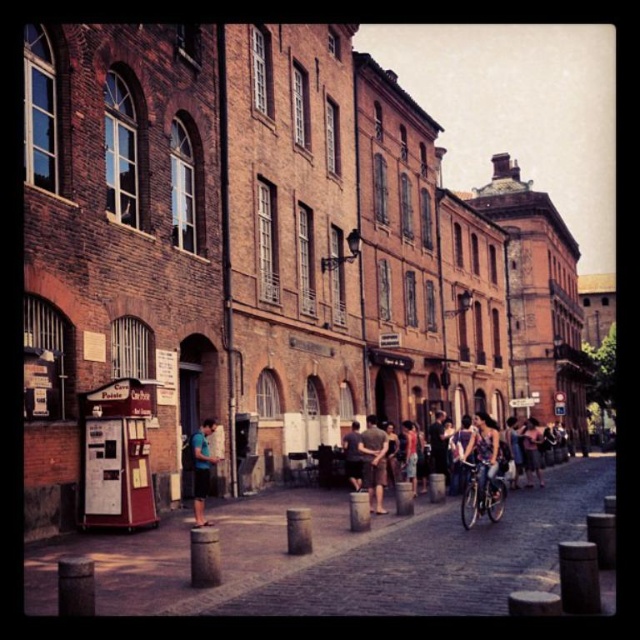
Question: Is blue fabric shirt at center wider than dark gray fabric pants at center?

Choices:
 (A) yes
 (B) no

Answer: (A)

Question: Which point is farther from the camera taking this photo?

Choices:
 (A) (208, 433)
 (B) (353, 477)
 (C) (488, 506)

Answer: (B)

Question: Which point is closer to the camera taking this photo?

Choices:
 (A) (476, 493)
 (B) (499, 515)
 (C) (200, 429)

Answer: (A)

Question: In this image, where is shiny silver bicycle at center-right located relative to dark gray fabric pants at center?

Choices:
 (A) right
 (B) left

Answer: (A)

Question: Among these objects, which one is farthest from the camera?

Choices:
 (A) matte purple bicycle at center
 (B) blue fabric shirt at center
 (C) dark gray fabric pants at center

Answer: (C)

Question: Is matte gray shirt at center bigger than dark gray fabric pants at center?

Choices:
 (A) yes
 (B) no

Answer: (A)